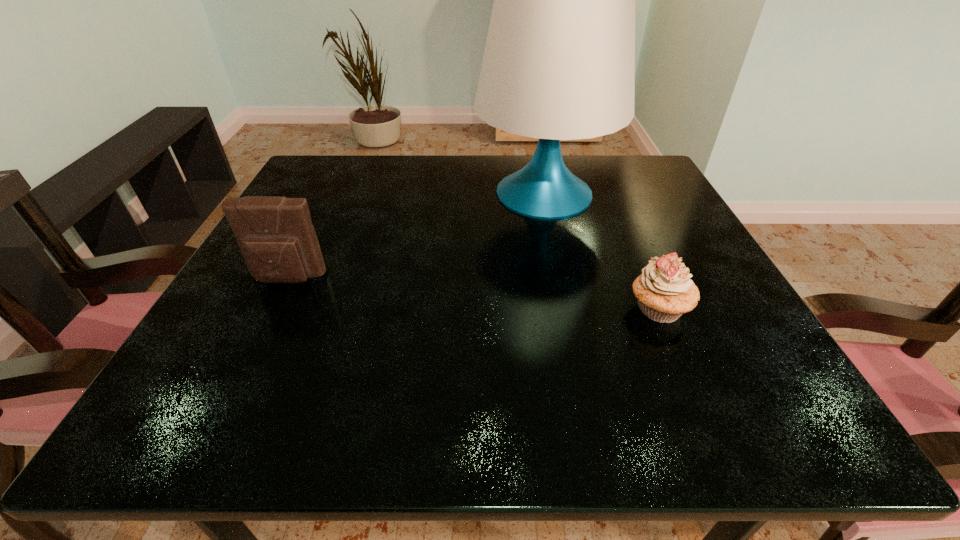
Where is `vacant area at the near left corner of the desktop`? vacant area at the near left corner of the desktop is located at coordinates 182,409.

The image size is (960, 540). In order to click on free space at the far right corner of the desktop in this screenshot , I will do `click(647, 191)`.

Where is `free space between the table lamp and the second tallest object`? free space between the table lamp and the second tallest object is located at coordinates (416, 237).

Identify the location of free space between the nearest object and the tallest object. (601, 252).

The width and height of the screenshot is (960, 540). What are the coordinates of `unoccupied area between the second farthest object and the nearest object` in the screenshot? It's located at (473, 294).

Where is `vacant area between the shortest object and the leftmost object`? vacant area between the shortest object and the leftmost object is located at coordinates (473, 294).

The width and height of the screenshot is (960, 540). What are the coordinates of `free point between the pouch and the table lamp` in the screenshot? It's located at click(x=416, y=237).

At what (x,y) coordinates should I click in order to perform the action: click on unoccupied position between the second shortest object and the farthest object. Please return your answer as a coordinate pair (x, y). This screenshot has width=960, height=540. Looking at the image, I should click on (416, 237).

The width and height of the screenshot is (960, 540). I want to click on free space between the cupcake and the second shortest object, so click(473, 294).

This screenshot has width=960, height=540. I want to click on free space that is in between the leftmost object and the cupcake, so click(x=473, y=294).